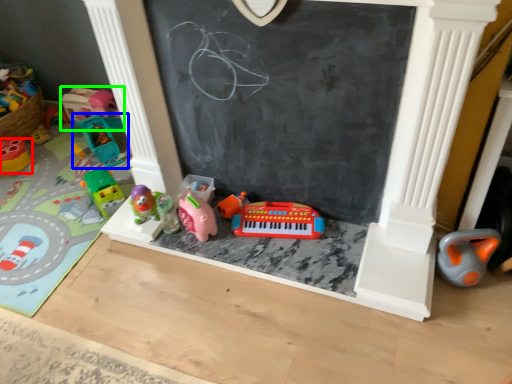
Question: Which is nearer to the toy (highlighted by a red box)? toy (highlighted by a blue box) or toy (highlighted by a green box).

Choices:
 (A) toy
 (B) toy

Answer: (A)